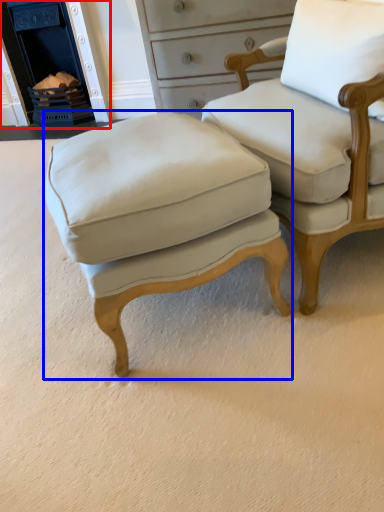
Question: Which point is closer to the camera, fireplace (highlighted by a red box) or stool (highlighted by a blue box)?

Choices:
 (A) fireplace
 (B) stool

Answer: (B)